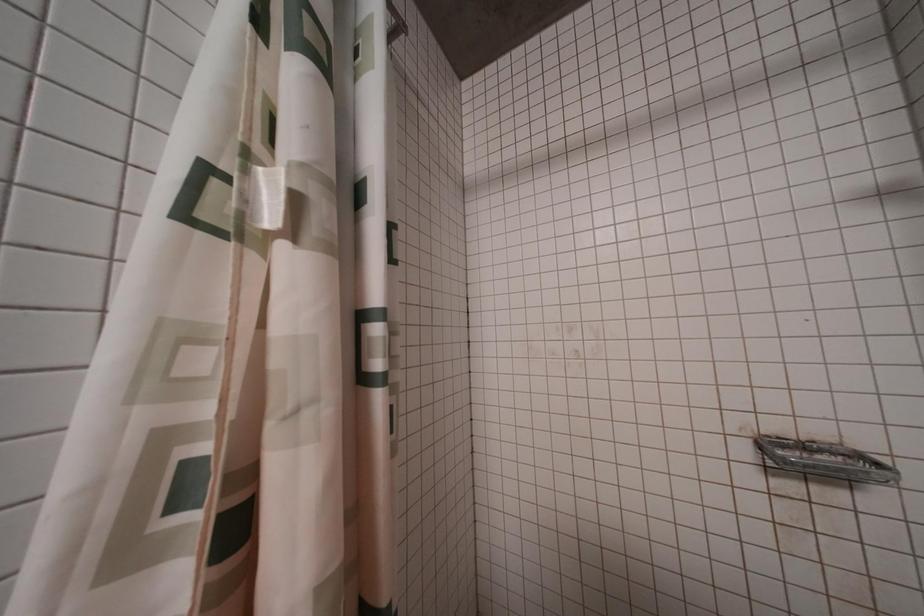
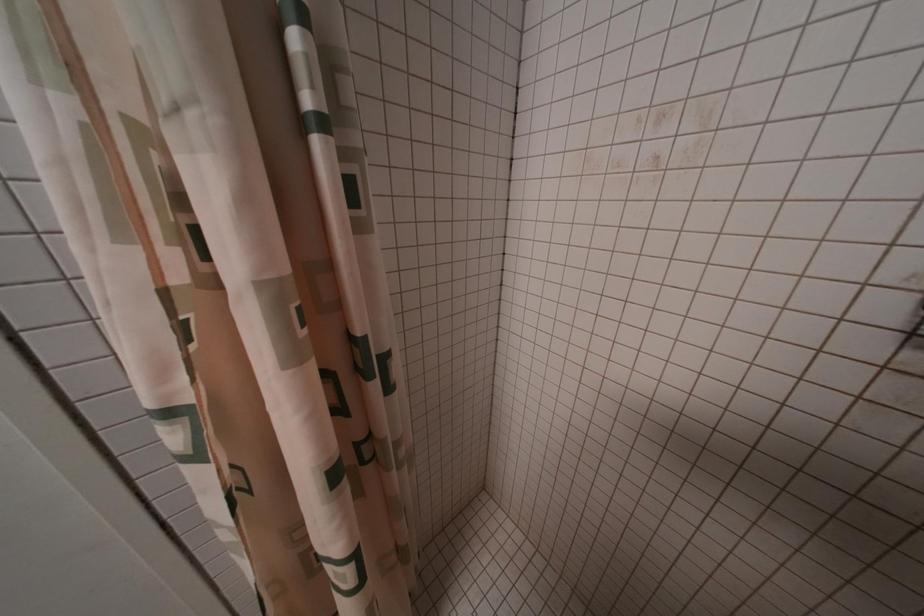
Consider the image. First-person continuous shooting, in which direction is the camera rotating?

The camera rotated toward left-down.